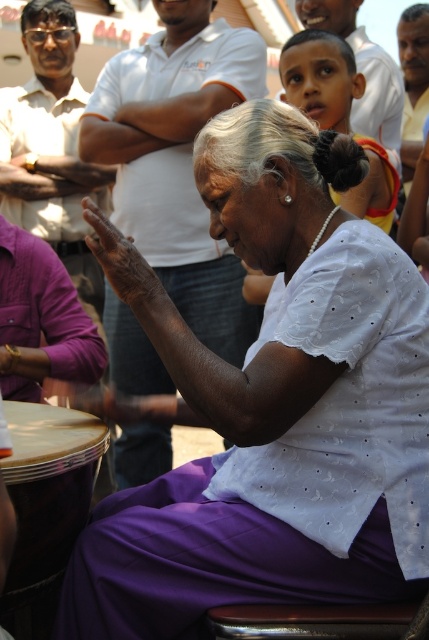
Question: Estimate the real-world distances between objects in this image. Which object is farther from the purple satin saree at center?

Choices:
 (A) white dotted blouse at center
 (B) purple leather drum at lower left

Answer: (A)

Question: From the image, what is the correct spatial relationship of purple leather drum at lower left in relation to white dotted blouse at center?

Choices:
 (A) right
 (B) left

Answer: (B)

Question: Which of the following is the farthest from the observer?

Choices:
 (A) white dotted blouse at center
 (B) purple leather drum at lower left

Answer: (A)

Question: Does purple leather drum at lower left appear over white dotted blouse at center?

Choices:
 (A) yes
 (B) no

Answer: (B)

Question: Does purple leather drum at lower left have a larger size compared to white dotted blouse at center?

Choices:
 (A) no
 (B) yes

Answer: (A)

Question: Which point is farther from the camera taking this photo?

Choices:
 (A) (53, 451)
 (B) (355, 74)
 (C) (296, 401)

Answer: (B)